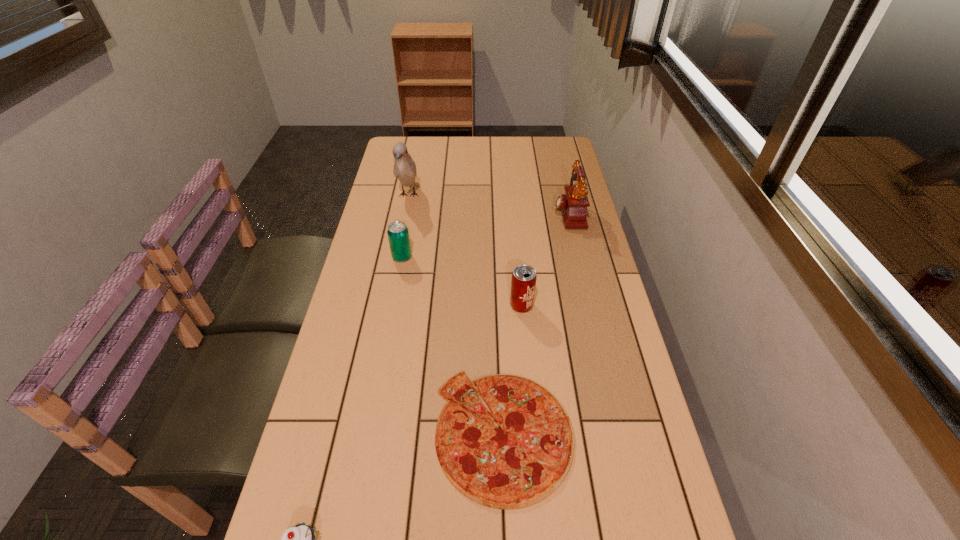
The width and height of the screenshot is (960, 540). Identify the location of free space at the left edge. (392, 167).

Where is `vacant space at the right edge of the desktop`? vacant space at the right edge of the desktop is located at coordinates (620, 325).

In the image, there is a desktop. At what (x,y) coordinates should I click in order to perform the action: click on vacant space at the far right corner. Please return your answer as a coordinate pair (x, y). Looking at the image, I should click on (569, 141).

Where is `empty location between the second nearest object and the fourth nearest object`? empty location between the second nearest object and the fourth nearest object is located at coordinates (453, 345).

Where is `vacant space that's between the second nearest object and the left beer can`? This screenshot has height=540, width=960. vacant space that's between the second nearest object and the left beer can is located at coordinates (453, 345).

You are a GUI agent. You are given a task and a screenshot of the screen. Output one action in this format:
    pyautogui.click(x=<x>, y=<y>)
    Task: Click on the unoccupied position between the bird and the second tallest object
    This screenshot has width=960, height=540.
    Given the screenshot: What is the action you would take?
    pyautogui.click(x=489, y=204)

Locate an element on the screen. The image size is (960, 540). empty space that is in between the nearer beer can and the shortest object is located at coordinates (513, 369).

The width and height of the screenshot is (960, 540). I want to click on free spot between the farther beer can and the shortest object, so coord(453,345).

Find the location of `vacant area between the tallest object and the nearer beer can`. vacant area between the tallest object and the nearer beer can is located at coordinates (465, 250).

Choose which object is the third nearest neighbor to the cupcake. Please provide its 2D coordinates. Your answer should be formatted as a tuple, i.e. [(x, y)], where the tuple contains the x and y coordinates of a point satisfying the conditions above.

[(398, 235)]